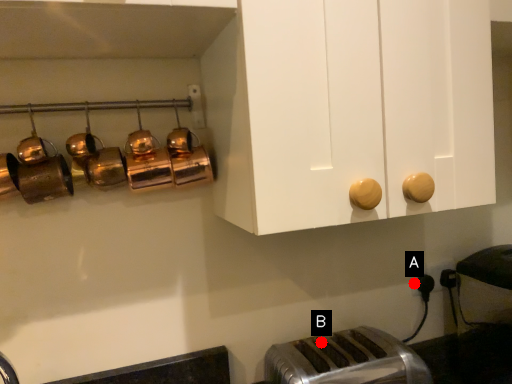
Question: Two points are circled on the image, labeled by A and B beside each circle. Which of the following is the closest to the observer?

Choices:
 (A) A is closer
 (B) B is closer

Answer: (B)